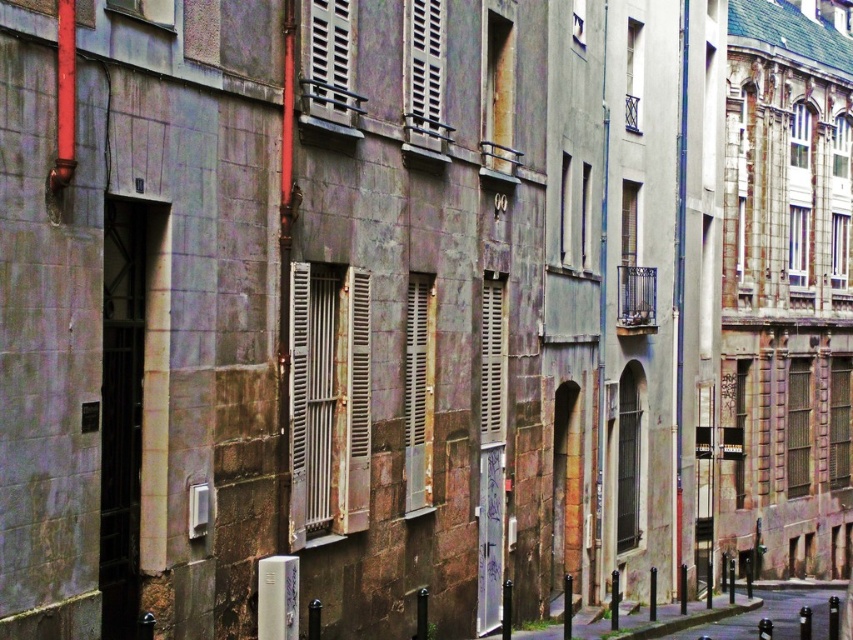
Question: Which object is closer to the camera taking this photo?

Choices:
 (A) wooden slats at center
 (B) white wooden shutter at center

Answer: (A)

Question: Which object is closer to the camera taking this photo?

Choices:
 (A) rusty metal shutter at center
 (B) brown wooden shutter at right
 (C) white wooden shutters at center
 (D) white wooden shutter at center

Answer: (C)

Question: Does rusty metal shutter at center have a lesser width compared to brown wooden shutter at right?

Choices:
 (A) no
 (B) yes

Answer: (A)

Question: In this image, where is white painted wood shutter at center located relative to brown wooden shutter at right?

Choices:
 (A) above
 (B) below

Answer: (A)

Question: Is rusty metal shutter at center to the right of white matte shutter at upper center from the viewer's perspective?

Choices:
 (A) yes
 (B) no

Answer: (B)

Question: Based on their relative distances, which object is farther from the brown wooden shutter at right?

Choices:
 (A) white wooden shutters at center
 (B) white matte shutter at upper center
 (C) white painted wood shutter at center
 (D) metallic silver shutter at center

Answer: (A)